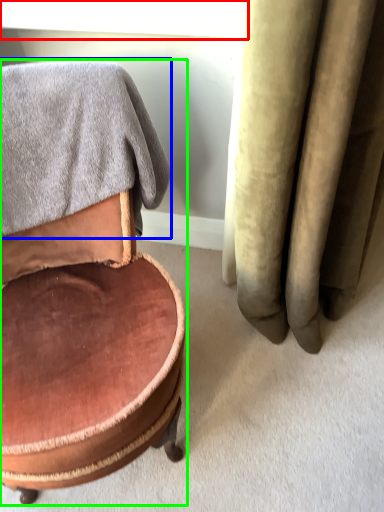
Question: Which is nearer to the window screen (highlighted by a red box)? bath towel (highlighted by a blue box) or chair (highlighted by a green box).

Choices:
 (A) bath towel
 (B) chair

Answer: (A)